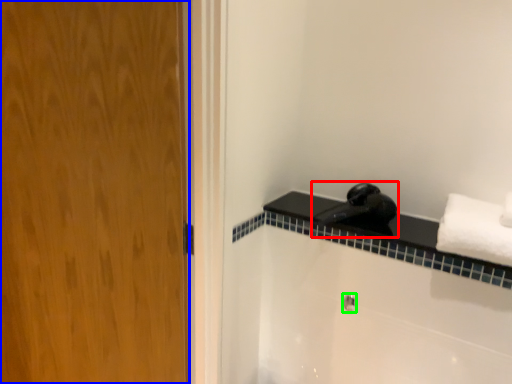
Question: Which is farther away from faucet (highlighted by a red box)? door (highlighted by a blue box) or shower (highlighted by a green box)?

Choices:
 (A) door
 (B) shower

Answer: (A)